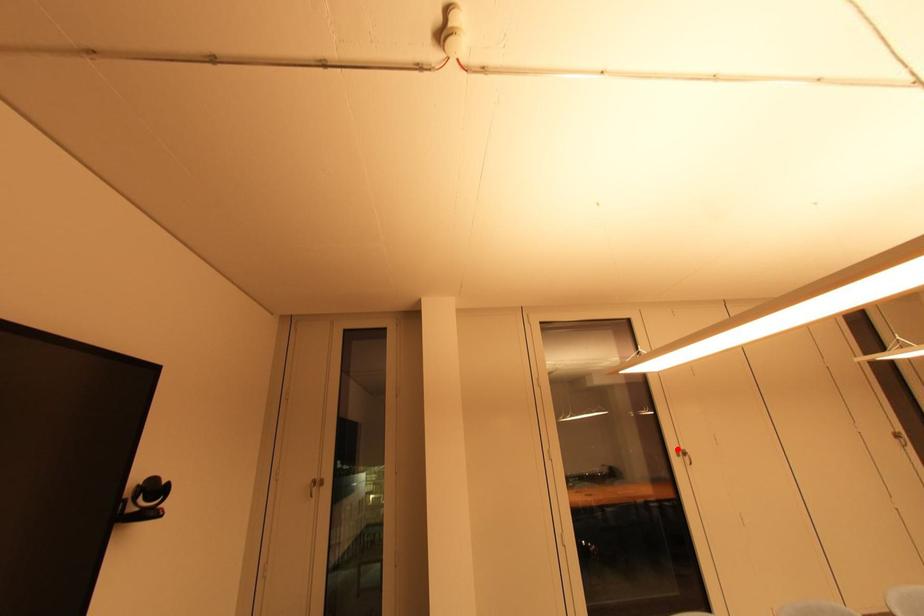
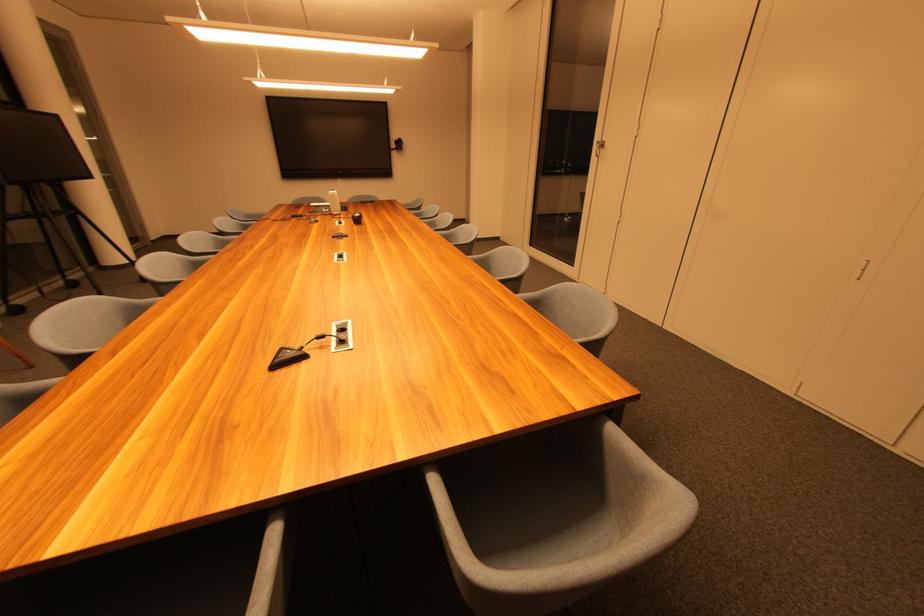
The point at the highlighted location is marked in the first image. Where is the corresponding point in the second image?

(602, 140)